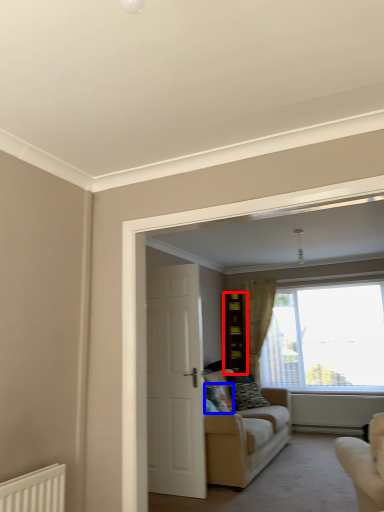
Question: Which object appears farthest to the camera in this image, cabinetry (highlighted by a red box) or pillow (highlighted by a blue box)?

Choices:
 (A) cabinetry
 (B) pillow

Answer: (A)